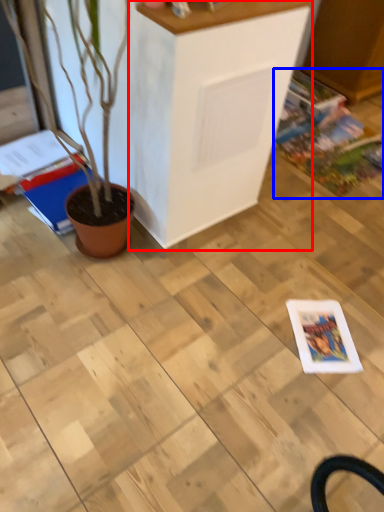
Question: Which point is further to the camera, furniture (highlighted by a red box) or comic book (highlighted by a blue box)?

Choices:
 (A) furniture
 (B) comic book

Answer: (B)